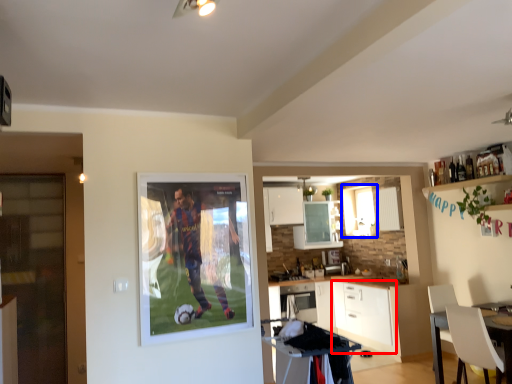
Question: Among these objects, which one is farthest to the camera, cabinetry (highlighted by a red box) or window (highlighted by a blue box)?

Choices:
 (A) cabinetry
 (B) window

Answer: (B)